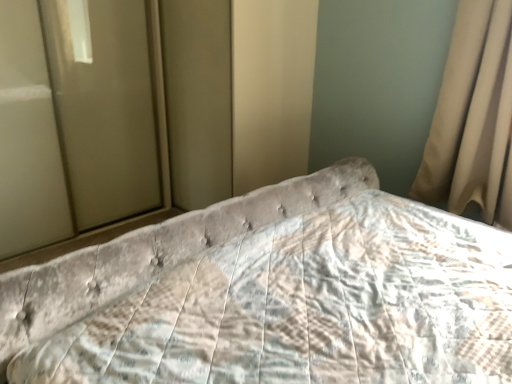
Question: Is matte glass door at left positioned with its back to velvet tufted headboard at center?

Choices:
 (A) no
 (B) yes

Answer: (A)

Question: From the image's perspective, is matte glass door at left under velvet tufted headboard at center?

Choices:
 (A) no
 (B) yes

Answer: (A)

Question: Can you confirm if matte glass door at left is positioned to the left of velvet tufted headboard at center?

Choices:
 (A) yes
 (B) no

Answer: (A)

Question: From a real-world perspective, is matte glass door at left physically above velvet tufted headboard at center?

Choices:
 (A) yes
 (B) no

Answer: (A)

Question: Is the position of matte glass door at left less distant than that of velvet tufted headboard at center?

Choices:
 (A) yes
 (B) no

Answer: (B)

Question: Is beige fabric curtain at right taller or shorter than matte glass door at left?

Choices:
 (A) tall
 (B) short

Answer: (B)

Question: From a real-world perspective, is beige fabric curtain at right above or below matte glass door at left?

Choices:
 (A) above
 (B) below

Answer: (A)

Question: Considering the positions of beige fabric curtain at right and matte glass door at left in the image, is beige fabric curtain at right bigger or smaller than matte glass door at left?

Choices:
 (A) big
 (B) small

Answer: (B)

Question: Considering the relative positions of beige fabric curtain at right and matte glass door at left in the image provided, is beige fabric curtain at right to the left or to the right of matte glass door at left?

Choices:
 (A) right
 (B) left

Answer: (A)

Question: Considering the positions of point (74, 59) and point (486, 205), is point (74, 59) closer or farther from the camera than point (486, 205)?

Choices:
 (A) farther
 (B) closer

Answer: (A)

Question: Looking at the image, does matte glass door at left seem bigger or smaller compared to beige fabric curtain at right?

Choices:
 (A) big
 (B) small

Answer: (A)

Question: Is matte glass door at left in front of or behind beige fabric curtain at right in the image?

Choices:
 (A) behind
 (B) front

Answer: (A)

Question: From a real-world perspective, is matte glass door at left above or below beige fabric curtain at right?

Choices:
 (A) above
 (B) below

Answer: (B)

Question: Is point (231, 304) closer or farther from the camera than point (480, 87)?

Choices:
 (A) farther
 (B) closer

Answer: (B)

Question: Is velvet tufted headboard at center taller or shorter than beige fabric curtain at right?

Choices:
 (A) tall
 (B) short

Answer: (B)